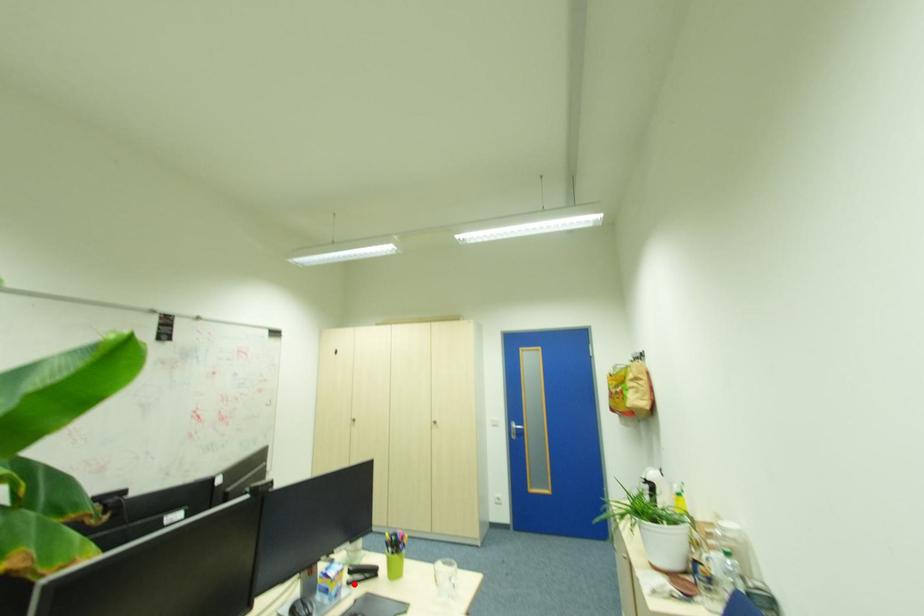
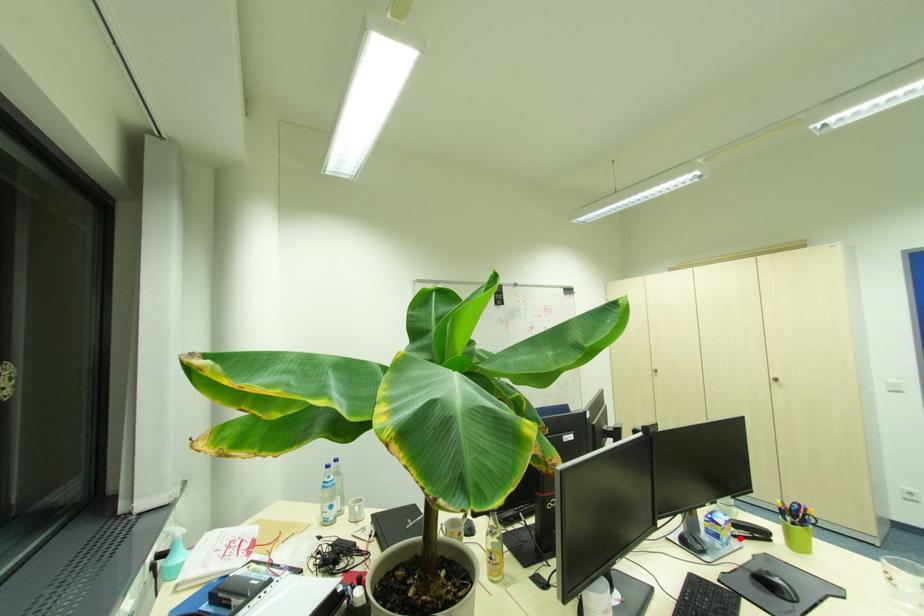
I am providing you with two images of the same scene from different viewpoints. A red point is marked on the first image and another point is marked on the second image. Are the points marked in image1 and image2 representing the same 3D position?

Yes